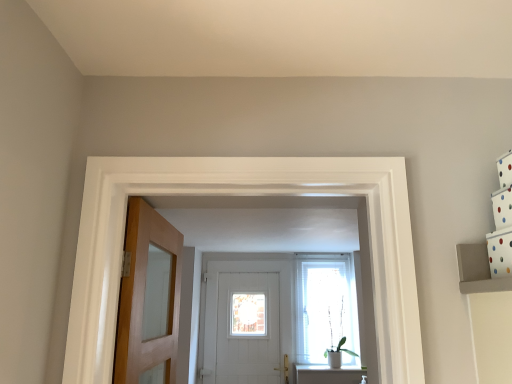
Question: Is white wooden door at center, marked as the 1th door in a back-to-front arrangement, further to camera compared to translucent fabric at center?

Choices:
 (A) no
 (B) yes

Answer: (A)

Question: From a real-world perspective, is white wooden door at center, arranged as the second door when viewed from the top, beneath translucent fabric at center?

Choices:
 (A) no
 (B) yes

Answer: (B)

Question: Does white wooden door at center, which is counted as the first door, starting from the bottom, appear on the left side of translucent fabric at center?

Choices:
 (A) yes
 (B) no

Answer: (A)

Question: From the image's perspective, is white wooden door at center, which is counted as the first door, starting from the bottom, located beneath translucent fabric at center?

Choices:
 (A) no
 (B) yes

Answer: (B)

Question: Is white wooden door at center, the 2th door viewed from the front, next to translucent fabric at center?

Choices:
 (A) no
 (B) yes

Answer: (A)

Question: In the image, is translucent fabric at center positioned in front of or behind green matte plant at center?

Choices:
 (A) front
 (B) behind

Answer: (B)

Question: Is translucent fabric at center inside or outside of green matte plant at center?

Choices:
 (A) inside
 (B) outside

Answer: (B)

Question: In the image, is translucent fabric at center on the left side or the right side of green matte plant at center?

Choices:
 (A) left
 (B) right

Answer: (A)

Question: In terms of size, does translucent fabric at center appear bigger or smaller than green matte plant at center?

Choices:
 (A) small
 (B) big

Answer: (A)

Question: Relative to light brown wooden door at left, which is the 2th door from bottom to top, is white wooden door at center, the 2th door viewed from the front, in front or behind?

Choices:
 (A) behind
 (B) front

Answer: (A)

Question: In the image, is white wooden door at center, the 2th door viewed from the front, on the left side or the right side of light brown wooden door at left, the 2th door from the back?

Choices:
 (A) right
 (B) left

Answer: (A)

Question: Is white wooden door at center, marked as the 1th door in a back-to-front arrangement, wider or thinner than light brown wooden door at left, acting as the first door starting from the front?

Choices:
 (A) thin
 (B) wide

Answer: (A)

Question: Is white wooden door at center, marked as the 1th door in a back-to-front arrangement, taller or shorter than light brown wooden door at left, which is the 2th door from bottom to top?

Choices:
 (A) tall
 (B) short

Answer: (A)

Question: Is light brown wooden door at left, the 1th door from the top, inside the boundaries of translucent fabric at center, or outside?

Choices:
 (A) outside
 (B) inside

Answer: (A)

Question: Based on their sizes in the image, would you say light brown wooden door at left, the 1th door from the top, is bigger or smaller than translucent fabric at center?

Choices:
 (A) big
 (B) small

Answer: (A)